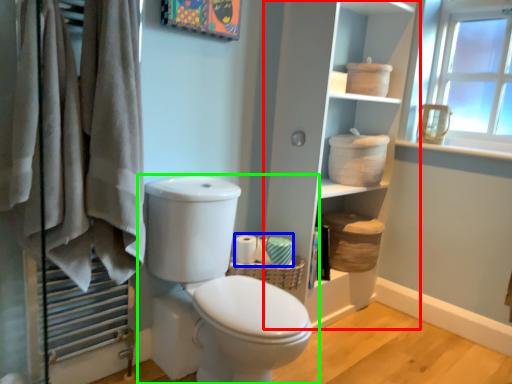
Question: Estimate the real-world distances between objects in this image. Which object is closer to bookshelf (highlighted by a red box), toilet paper (highlighted by a blue box) or toilet (highlighted by a green box)?

Choices:
 (A) toilet paper
 (B) toilet

Answer: (A)